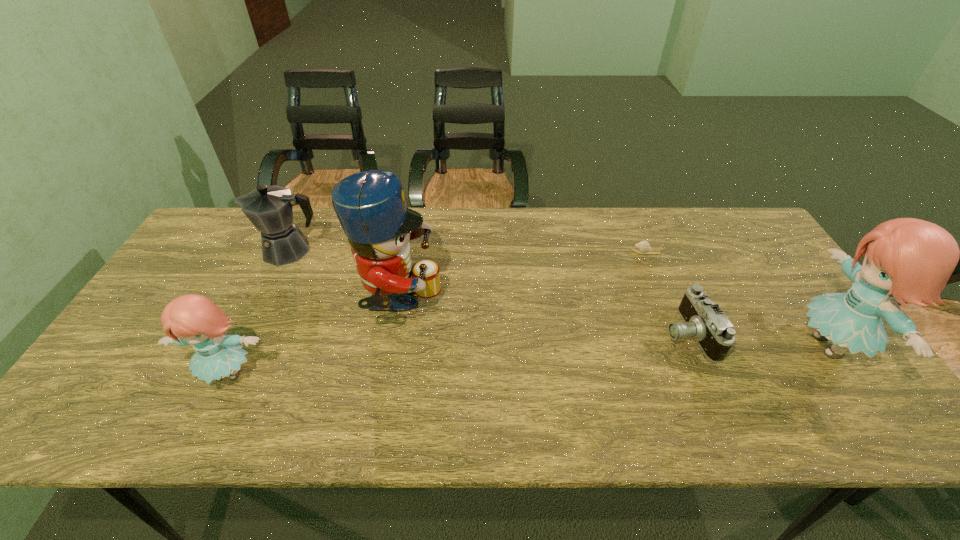
Find the location of a particular element. object at the right edge is located at coordinates (913, 259).

I want to click on object located at the near right corner, so click(913, 259).

The width and height of the screenshot is (960, 540). Find the location of `blank space at the far edge of the desktop`. blank space at the far edge of the desktop is located at coordinates 659,224.

Where is `vacant space at the near edge of the desktop`? The width and height of the screenshot is (960, 540). vacant space at the near edge of the desktop is located at coordinates (734, 381).

This screenshot has width=960, height=540. In order to click on vacant space at the right edge of the desktop in this screenshot , I will do `click(774, 281)`.

Identify the location of vacant space at the far left corner of the desktop. (249, 233).

In the image, there is a desktop. Identify the location of vacant space at the far right corner. This screenshot has width=960, height=540. (754, 231).

Find the location of a particular element. The height and width of the screenshot is (540, 960). free point between the camera and the right doll is located at coordinates (758, 340).

Find the location of `unoccupied area between the fourth object from right to left and the shorter doll`. unoccupied area between the fourth object from right to left and the shorter doll is located at coordinates (314, 339).

The width and height of the screenshot is (960, 540). I want to click on empty space between the third object from left to right and the second shortest object, so click(x=543, y=319).